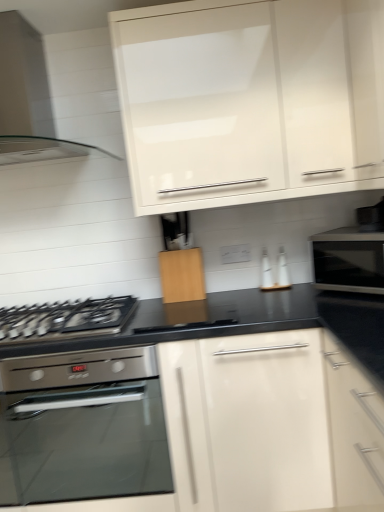
Question: Is wooden cutting board at center, which ranks as the 2th cabinetry in top-to-bottom order, not inside clear glass range hood at upper left?

Choices:
 (A) yes
 (B) no

Answer: (A)

Question: Can you confirm if wooden cutting board at center, which is the 1th cabinetry in bottom-to-top order, is wider than clear glass range hood at upper left?

Choices:
 (A) no
 (B) yes

Answer: (A)

Question: From the image's perspective, is wooden cutting board at center, which ranks as the 2th cabinetry in top-to-bottom order, on top of clear glass range hood at upper left?

Choices:
 (A) no
 (B) yes

Answer: (A)

Question: Is wooden cutting board at center, which is the 1th cabinetry in bottom-to-top order, thinner than clear glass range hood at upper left?

Choices:
 (A) no
 (B) yes

Answer: (B)

Question: Is wooden cutting board at center, which is the 1th cabinetry in bottom-to-top order, positioned far away from clear glass range hood at upper left?

Choices:
 (A) yes
 (B) no

Answer: (B)

Question: Is stainless steel oven at lower left to the left or to the right of black glossy microwave at right in the image?

Choices:
 (A) left
 (B) right

Answer: (A)

Question: Is stainless steel oven at lower left wider or thinner than black glossy microwave at right?

Choices:
 (A) thin
 (B) wide

Answer: (B)

Question: Relative to black glossy microwave at right, is stainless steel oven at lower left in front or behind?

Choices:
 (A) behind
 (B) front

Answer: (B)

Question: Is stainless steel oven at lower left taller or shorter than black glossy microwave at right?

Choices:
 (A) short
 (B) tall

Answer: (B)

Question: Is white glossy cabinet at upper center, arranged as the first cabinetry when viewed from the top, taller or shorter than black glossy microwave at right?

Choices:
 (A) tall
 (B) short

Answer: (A)

Question: Is white glossy cabinet at upper center, arranged as the first cabinetry when viewed from the top, bigger or smaller than black glossy microwave at right?

Choices:
 (A) big
 (B) small

Answer: (A)

Question: From a real-world perspective, is white glossy cabinet at upper center, arranged as the first cabinetry when viewed from the top, positioned above or below black glossy microwave at right?

Choices:
 (A) below
 (B) above

Answer: (B)

Question: From the image's perspective, is white glossy cabinet at upper center, which is the second cabinetry from bottom to top, above or below black glossy microwave at right?

Choices:
 (A) below
 (B) above

Answer: (B)

Question: Considering the positions of clear glass range hood at upper left and wooden cutting board at center, which is the 1th cabinetry in bottom-to-top order, in the image, is clear glass range hood at upper left wider or thinner than wooden cutting board at center, which is the 1th cabinetry in bottom-to-top order,?

Choices:
 (A) thin
 (B) wide

Answer: (B)

Question: Would you say clear glass range hood at upper left is inside or outside wooden cutting board at center, which ranks as the 2th cabinetry in top-to-bottom order?

Choices:
 (A) inside
 (B) outside

Answer: (B)